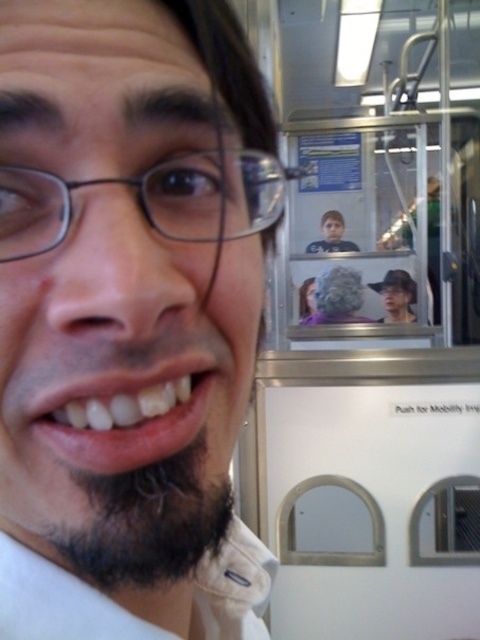
Does matte black glasses at upper left have a greater height compared to dark brown fuzzy beard at lower left?

No, matte black glasses at upper left is not taller than dark brown fuzzy beard at lower left.

Is matte black glasses at upper left shorter than dark brown fuzzy beard at lower left?

Yes, matte black glasses at upper left is shorter than dark brown fuzzy beard at lower left.

What do you see at coordinates (152, 198) in the screenshot? I see `matte black glasses at upper left` at bounding box center [152, 198].

Where is `matte black glasses at upper left`? The width and height of the screenshot is (480, 640). matte black glasses at upper left is located at coordinates (152, 198).

Is white matte face at center further to camera compared to matte black glasses at upper left?

No, it is not.

Does white matte face at center appear on the left side of matte black glasses at upper left?

Correct, you'll find white matte face at center to the left of matte black glasses at upper left.

Is point (192, 120) closer to camera compared to point (204, 216)?

Yes, point (192, 120) is in front of point (204, 216).

At what (x,y) coordinates should I click in order to perform the action: click on white matte face at center. Please return your answer as a coordinate pair (x, y). The height and width of the screenshot is (640, 480). Looking at the image, I should click on coord(130,316).

In the scene shown: Who is positioned more to the right, matte black glasses at upper left or white glossy teeth at lower center?

Positioned to the right is matte black glasses at upper left.

What are the coordinates of `matte black glasses at upper left` in the screenshot? It's located at (152, 198).

This screenshot has height=640, width=480. What are the coordinates of `matte black glasses at upper left` in the screenshot? It's located at (152, 198).

Locate an element on the screen. matte black glasses at upper left is located at coordinates (152, 198).